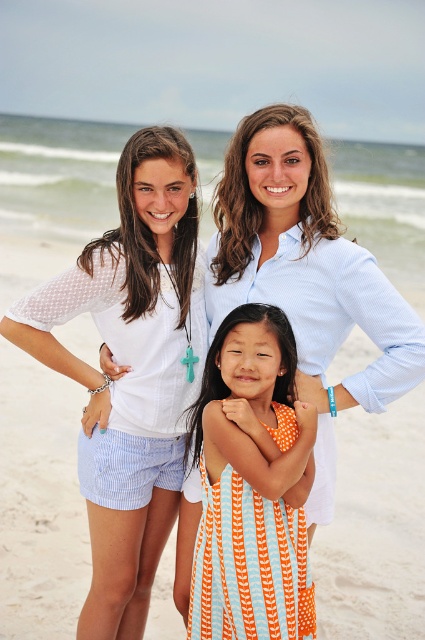
Question: Estimate the real-world distances between objects in this image. Which object is farther from the light blue striped shirt at center?

Choices:
 (A) white seersucker shorts at left
 (B) orange striped dress at center

Answer: (A)

Question: Is white seersucker shorts at left positioned in front of light blue striped shirt at center?

Choices:
 (A) yes
 (B) no

Answer: (B)

Question: Can you confirm if white seersucker shorts at left is positioned above light blue striped shirt at center?

Choices:
 (A) yes
 (B) no

Answer: (B)

Question: Which point is farther to the camera?

Choices:
 (A) (365, 397)
 (B) (129, 339)
 (C) (269, 396)

Answer: (B)

Question: In this image, where is light blue striped shirt at center located relative to orange striped dress at center?

Choices:
 (A) below
 (B) above

Answer: (B)

Question: Which point appears closest to the camera in this image?

Choices:
 (A) (116, 433)
 (B) (308, 333)
 (C) (274, 461)

Answer: (C)